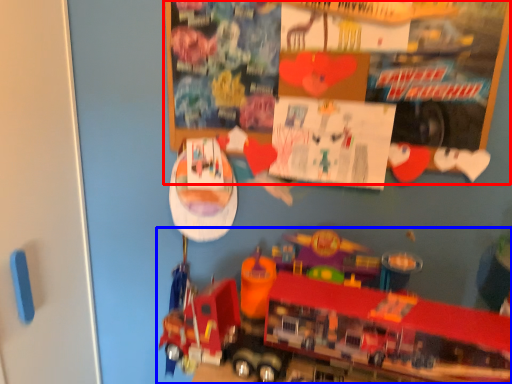
Question: Among these objects, which one is nearest to the camera, bulletin board (highlighted by a red box) or toy (highlighted by a blue box)?

Choices:
 (A) bulletin board
 (B) toy

Answer: (B)